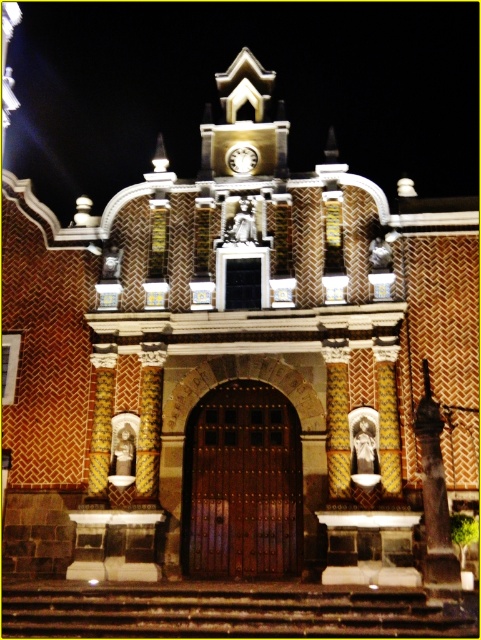
You are standing in front of the historic building and want to locate the dark brown stone statue at right. According to the coordinates provided, where should you look to find it?

The dark brown stone statue at right is located at coordinates point (x=434, y=496), so you should look to the lower right side of the building facade.